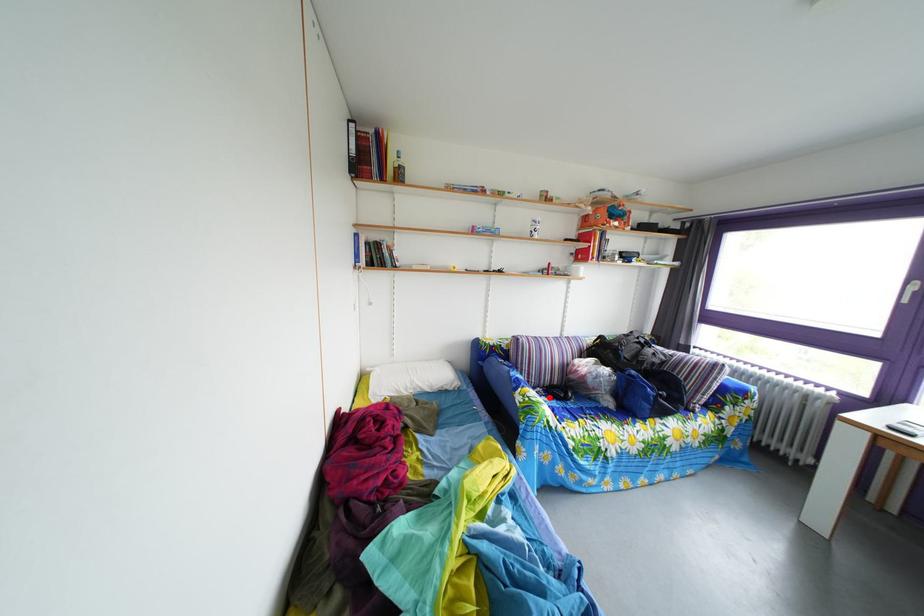
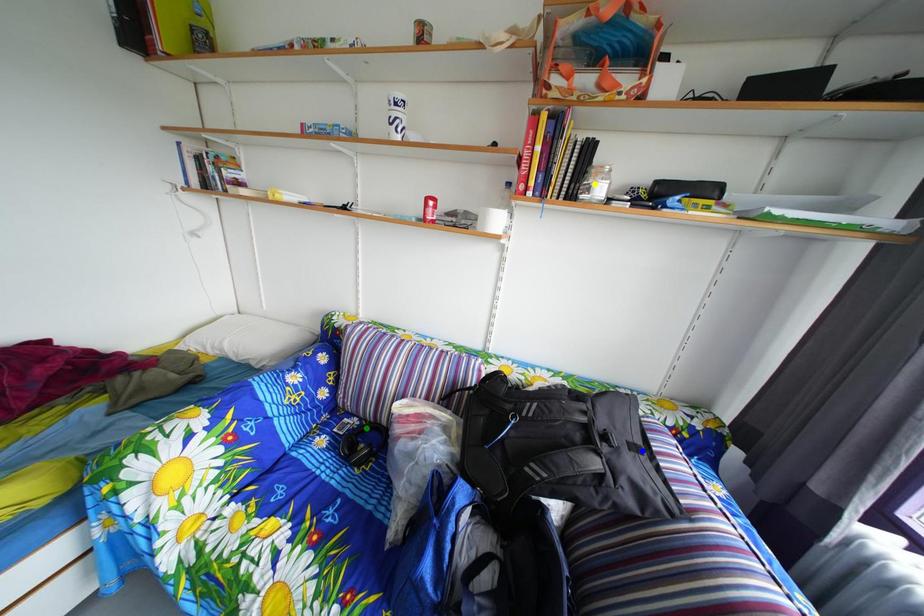
Question: I am providing you with two images of the same scene from different viewpoints. A red point is marked on the first image. You are given multiple points on the second image. Can you choose the point in image 2 that corresponds to the point in image 1?

Choices:
 (A) blue point
 (B) yellow point
 (C) green point

Answer: (C)